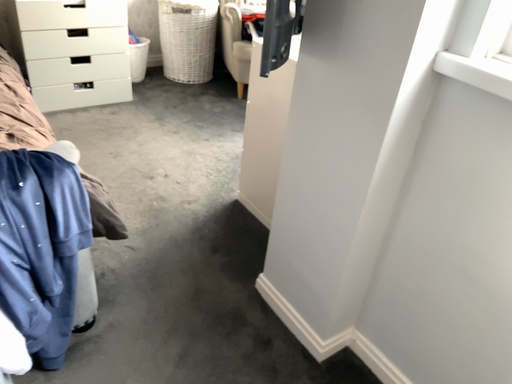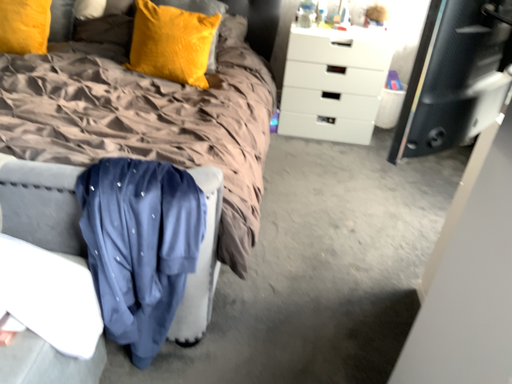
Question: How did the camera likely rotate when shooting the video?

Choices:
 (A) rotated downward
 (B) rotated upward

Answer: (B)